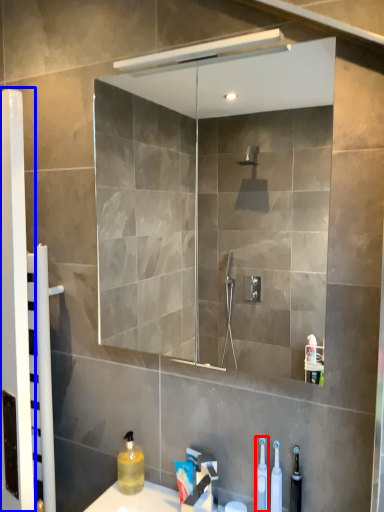
Question: Which object appears farthest to the camera in this image, toiletry (highlighted by a red box) or screen door (highlighted by a blue box)?

Choices:
 (A) toiletry
 (B) screen door

Answer: (B)